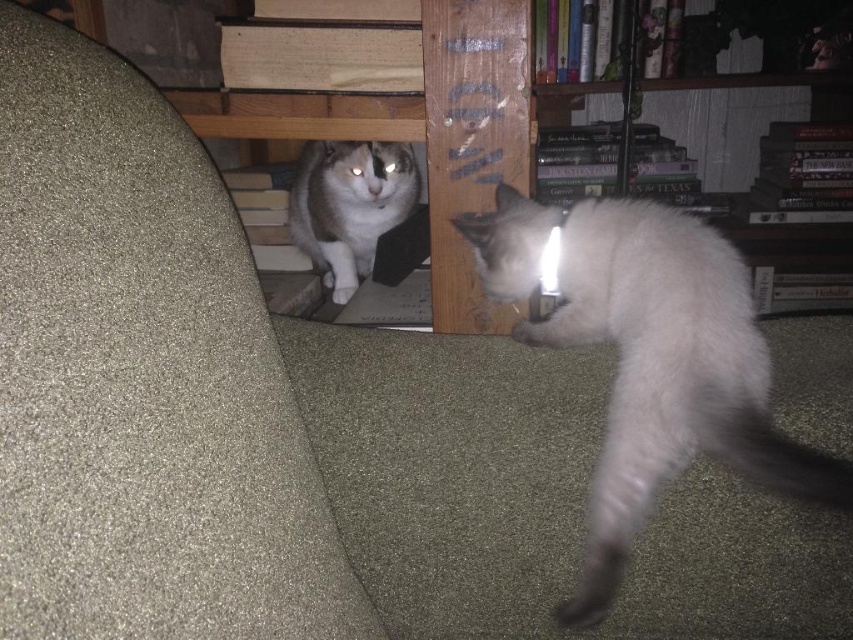
You are a photographer setting up a tripod to capture the cats in the scene. The tripod has a maximum reach of 75 centimeters. Can you reach the point at point (634,214) with your tripod?

The distance of point (634,214) from camera is 76.57 centimeters, so the tripod cannot reach it since its maximum reach is 75 centimeters.